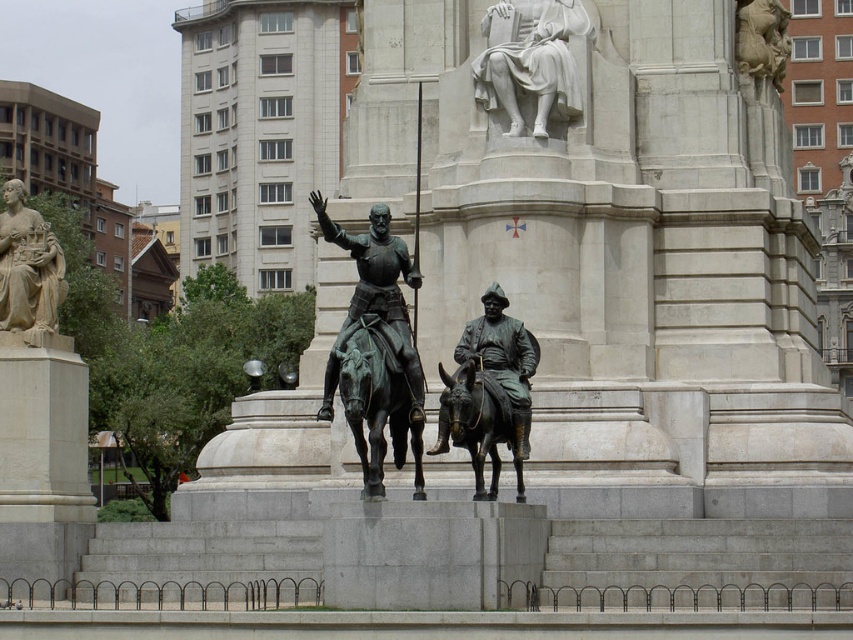
You are standing in front of the monument and notice two points marked on the base. The first point is at coordinate point [352,353] and the second at point [514,387]. Which point is closer to you?

Point [352,353] is closer to the viewer than point [514,387].

Consider the image. Based on the scene description, where is the polished bronze statue at left located in terms of its 2D coordinates?

The polished bronze statue at left is located at the 2D coordinates of point (28, 268).

You are an art student analyzing the monument. You observe the white marble statue at upper center and the green patina statue at center. Which statue has a greater height?

The green patina statue at center is taller than the white marble statue at upper center.